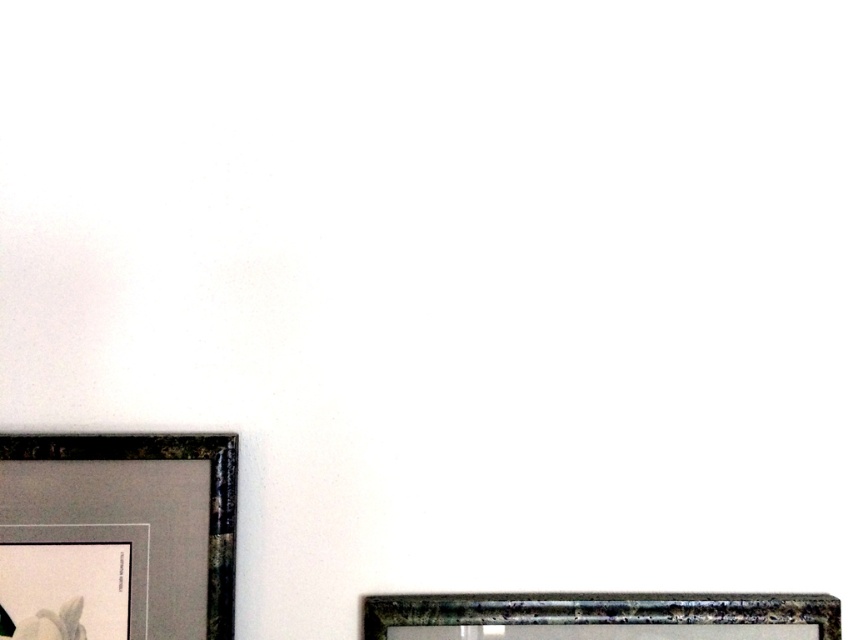
Consider the image. Does metallic silver picture frame at lower right come behind metallic gold picture frame at lower left?

Yes, metallic silver picture frame at lower right is behind metallic gold picture frame at lower left.

In the scene shown: Can you confirm if metallic silver picture frame at lower right is thinner than metallic gold picture frame at lower left?

In fact, metallic silver picture frame at lower right might be wider than metallic gold picture frame at lower left.

This screenshot has width=853, height=640. In order to click on metallic silver picture frame at lower right in this screenshot , I will do click(x=601, y=616).

Where is `metallic silver picture frame at lower right`? This screenshot has width=853, height=640. metallic silver picture frame at lower right is located at coordinates (601, 616).